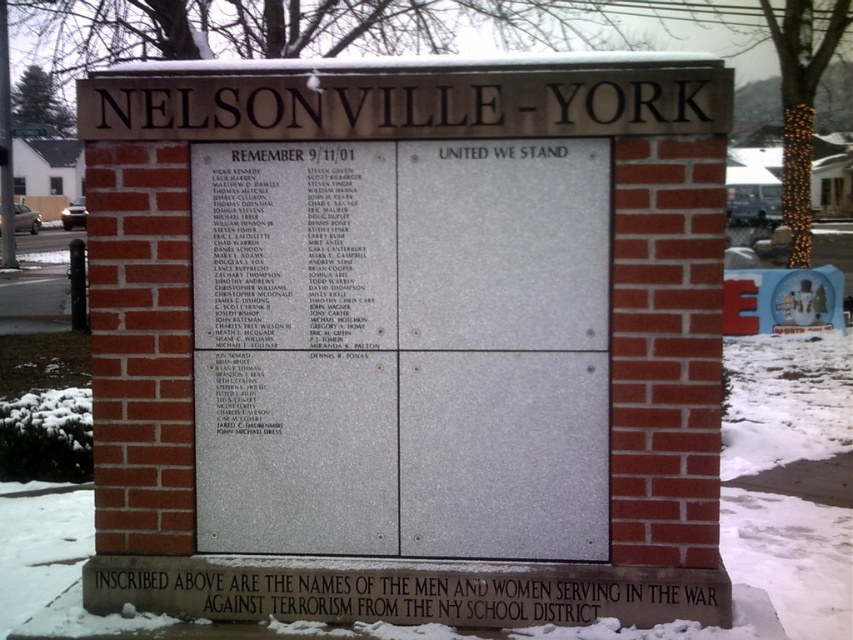
The height and width of the screenshot is (640, 853). Describe the element at coordinates (786, 400) in the screenshot. I see `white powdery snow at lower center` at that location.

Between white powdery snow at lower center and black stone plaque at lower center, which one has less height?

With less height is black stone plaque at lower center.

Does point (756, 570) come behind point (560, 609)?

That is True.

At what (x,y) coordinates should I click in order to perform the action: click on white powdery snow at lower center. Please return your answer as a coordinate pair (x, y). The image size is (853, 640). Looking at the image, I should click on (786, 400).

Can you confirm if black polished stone plaque at center is positioned to the right of white powdery snow at lower center?

No, black polished stone plaque at center is not to the right of white powdery snow at lower center.

Is black polished stone plaque at center above white powdery snow at lower center?

Correct, black polished stone plaque at center is located above white powdery snow at lower center.

Is point (325, 512) farther from viewer compared to point (77, 550)?

No, (325, 512) is in front of (77, 550).

The width and height of the screenshot is (853, 640). Find the location of `black polished stone plaque at center`. black polished stone plaque at center is located at coordinates (402, 348).

Is point (368, 410) less distant than point (549, 618)?

No.

Who is lower down, black polished stone plaque at center or black stone plaque at lower center?

black stone plaque at lower center is below.

At what (x,y) coordinates should I click in order to perform the action: click on black polished stone plaque at center. Please return your answer as a coordinate pair (x, y). Looking at the image, I should click on (402, 348).

Locate an element on the screen. black polished stone plaque at center is located at coordinates (402, 348).